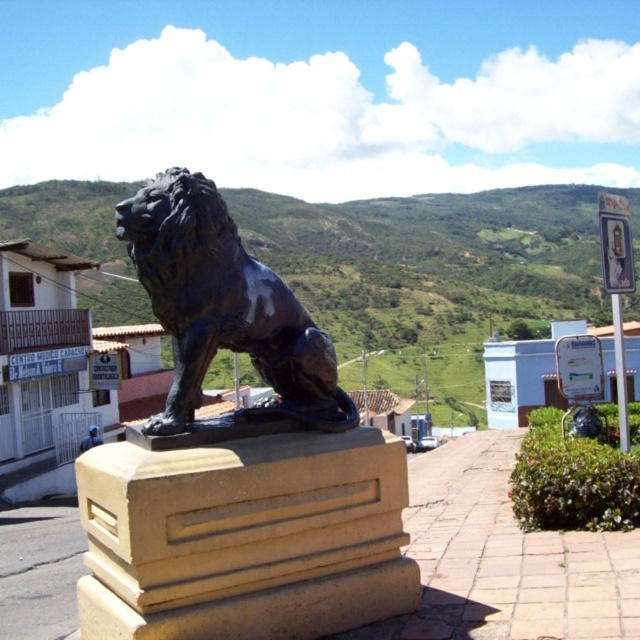
Question: Considering the real-world distances, which object is closest to the black polished stone lion at center?

Choices:
 (A) beige stone pedestal at center
 (B) shiny black lion at center

Answer: (A)

Question: Does black polished stone lion at center appear over shiny black lion at center?

Choices:
 (A) yes
 (B) no

Answer: (B)

Question: Is black polished stone lion at center smaller than shiny black lion at center?

Choices:
 (A) no
 (B) yes

Answer: (A)

Question: Which object is positioned farthest from the black polished stone lion at center?

Choices:
 (A) shiny black lion at center
 (B) beige stone pedestal at center

Answer: (A)

Question: Does black polished stone lion at center appear over beige stone pedestal at center?

Choices:
 (A) yes
 (B) no

Answer: (A)

Question: Which of the following is the farthest from the observer?

Choices:
 (A) 401,506
 (B) 180,541
 (C) 198,262

Answer: (A)